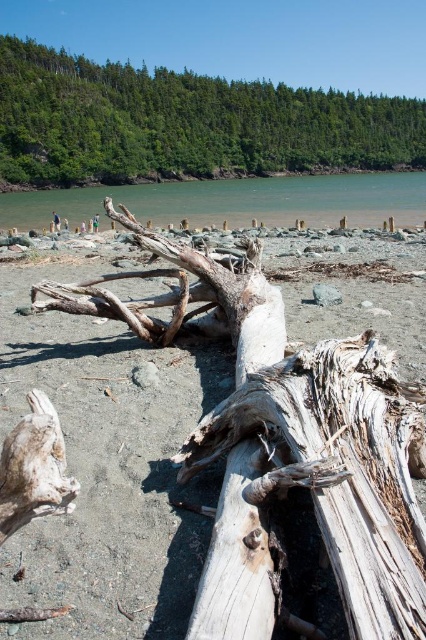
Who is lower down, green leafy tree at upper center or gray weathered wood log at center?

Positioned lower is gray weathered wood log at center.

Can you confirm if green leafy tree at upper center is taller than gray weathered wood log at center?

Correct, green leafy tree at upper center is much taller as gray weathered wood log at center.

Between point (134, 163) and point (385, 404), which one is positioned in front?

Positioned in front is point (385, 404).

Locate an element on the screen. The image size is (426, 640). green leafy tree at upper center is located at coordinates (184, 124).

Between gray weathered wood log at center and clear water at center, which one is positioned lower?

gray weathered wood log at center is below.

Who is positioned more to the right, gray weathered wood log at center or clear water at center?

gray weathered wood log at center is more to the right.

Who is more forward, (x=301, y=387) or (x=127, y=198)?

Point (x=301, y=387) is in front.

At what (x,y) coordinates should I click in order to perform the action: click on gray weathered wood log at center. Please return your answer as a coordinate pair (x, y). The image size is (426, 640). Looking at the image, I should click on (339, 468).

Is weathered wood driftwood at center taller than green leafy tree at upper center?

No.

Is point (305, 538) behind point (109, 106)?

No, (305, 538) is closer to viewer.

Between point (340, 461) and point (71, 102), which one is positioned behind?

The point (71, 102) is more distant.

This screenshot has height=640, width=426. Identify the location of weathered wood driftwood at center. [293, 464].